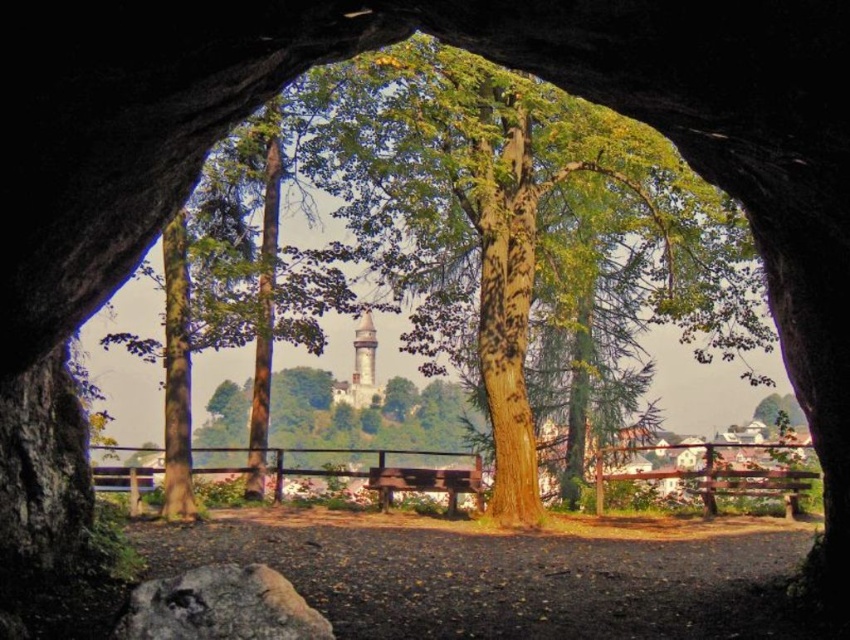
Is green rough bark tree at center to the left of stone tower at center from the viewer's perspective?

No, green rough bark tree at center is not to the left of stone tower at center.

What do you see at coordinates (519, 220) in the screenshot?
I see `green rough bark tree at center` at bounding box center [519, 220].

This screenshot has height=640, width=850. What do you see at coordinates (519, 220) in the screenshot?
I see `green rough bark tree at center` at bounding box center [519, 220].

The height and width of the screenshot is (640, 850). I want to click on green rough bark tree at center, so click(x=519, y=220).

Is point (372, 488) positioned in front of point (350, 404)?

Yes.

Image resolution: width=850 pixels, height=640 pixels. Describe the element at coordinates (426, 483) in the screenshot. I see `wooden park bench at center` at that location.

Does point (472, 476) lie behind point (361, 317)?

No, (472, 476) is closer to viewer.

The width and height of the screenshot is (850, 640). I want to click on wooden park bench at center, so click(x=426, y=483).

Looking at this image, is green rough bark tree at center below wooden park bench at center?

No.

Is point (684, 250) farther from viewer compared to point (384, 476)?

Yes, it is.

Find the location of a particular element. green rough bark tree at center is located at coordinates (519, 220).